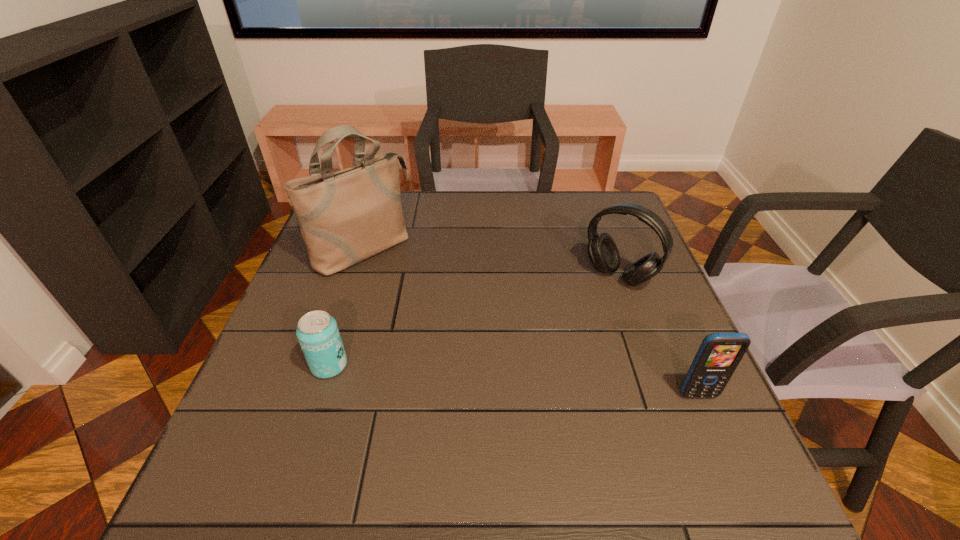
Find the location of a particular element. vacant space at the left edge of the desktop is located at coordinates (276, 323).

This screenshot has width=960, height=540. I want to click on vacant space at the right edge of the desktop, so click(627, 286).

This screenshot has width=960, height=540. I want to click on free space at the near left corner of the desktop, so click(300, 435).

The width and height of the screenshot is (960, 540). In order to click on vacant space at the far right corner of the desktop in this screenshot , I will do `click(622, 231)`.

Identify the location of empty location between the second nearest object and the headset. (474, 321).

Identify the location of vacant point located between the cellular telephone and the third farthest object. This screenshot has height=540, width=960. (514, 380).

Find the location of a particular element. This screenshot has width=960, height=540. vacant point located between the nearest object and the headset is located at coordinates (659, 336).

The height and width of the screenshot is (540, 960). In order to click on free spot between the third farthest object and the nearest object in this screenshot , I will do `click(514, 380)`.

Locate an element on the screen. empty space that is in between the tallest object and the shortest object is located at coordinates pyautogui.click(x=346, y=307).

Locate an element on the screen. Image resolution: width=960 pixels, height=540 pixels. free space that is in between the headset and the shoulder bag is located at coordinates (491, 262).